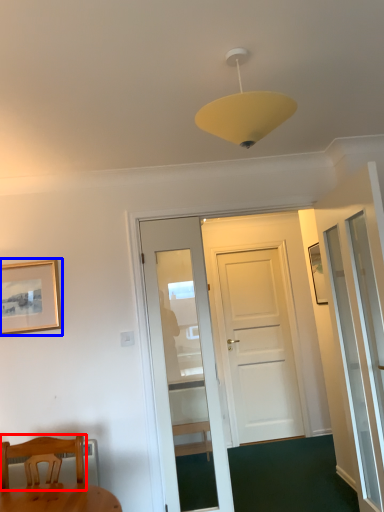
Question: Which of the following is the closest to the observer, chair (highlighted by a red box) or picture frame (highlighted by a blue box)?

Choices:
 (A) chair
 (B) picture frame

Answer: (A)